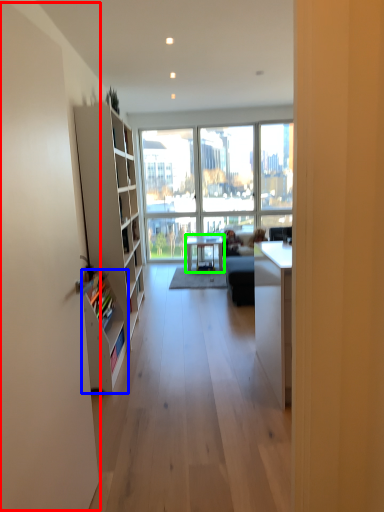
Question: Which object is positioned farthest from screen door (highlighted by a red box)? Select from shelf (highlighted by a blue box) and table (highlighted by a green box).

Choices:
 (A) shelf
 (B) table

Answer: (B)